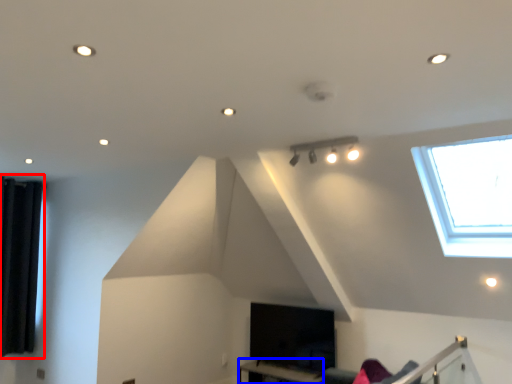
Question: Which point is further to the camera, curtain (highlighted by a red box) or table (highlighted by a blue box)?

Choices:
 (A) curtain
 (B) table

Answer: (A)